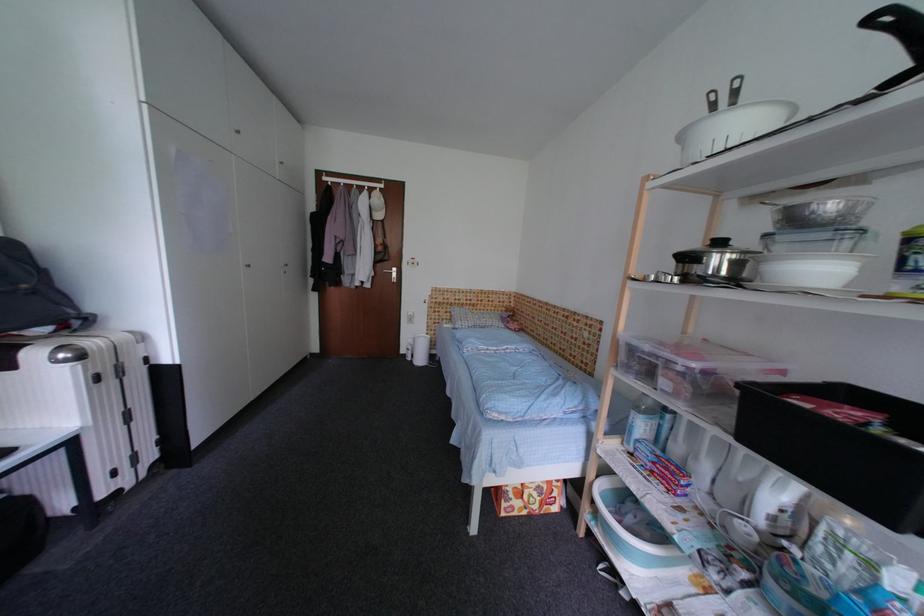
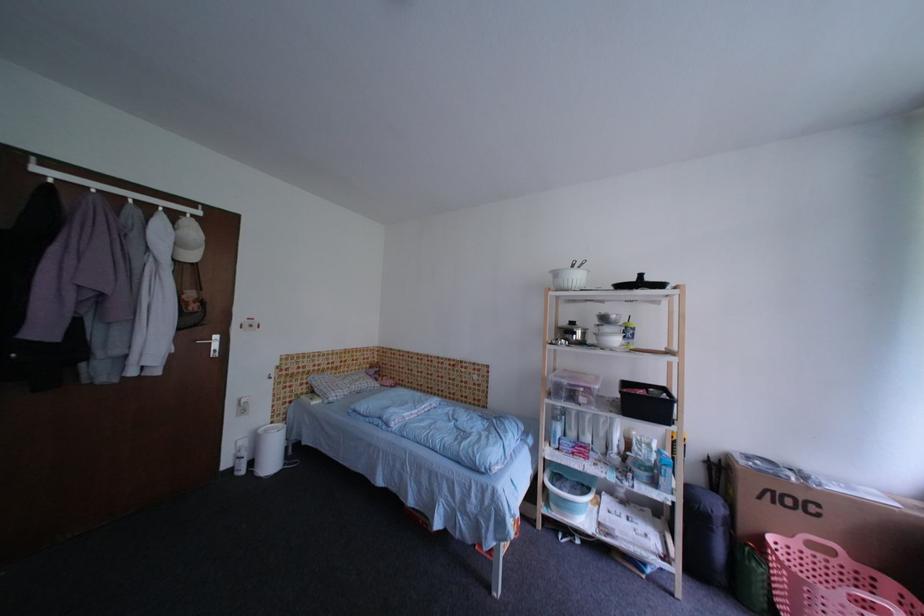
Question: The camera is either moving clockwise (left) or counter-clockwise (right) around the object. The first image is from the beginning of the video and the second image is from the end. Is the camera moving left or right when shooting the video?

Choices:
 (A) Left
 (B) Right

Answer: (A)